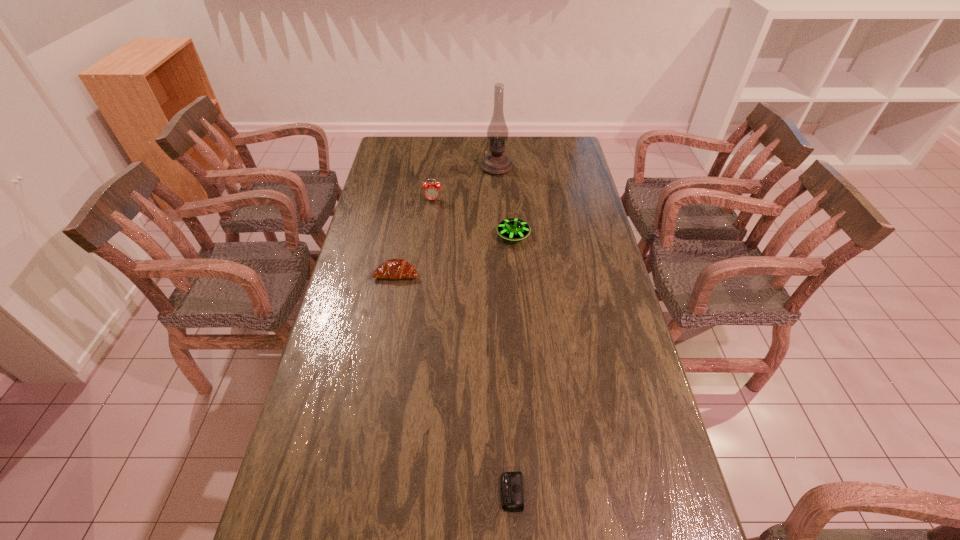
Where is `vacant point located between the second farthest object and the fourth farthest object`? The height and width of the screenshot is (540, 960). vacant point located between the second farthest object and the fourth farthest object is located at coordinates click(415, 237).

You are a GUI agent. You are given a task and a screenshot of the screen. Output one action in this format:
    pyautogui.click(x=<x>, y=<y>)
    Task: Click on the vacant area that lies between the fourth farthest object and the left alarm clock
    
    Given the screenshot: What is the action you would take?
    pyautogui.click(x=415, y=237)

Find the location of a particular element. This screenshot has height=540, width=960. free spot between the tallest object and the fourth farthest object is located at coordinates tap(446, 220).

Find the location of a particular element. free space between the second tallest object and the nearest object is located at coordinates 472,346.

Choose which object is the nearest neighbor to the third shortest object. Please provide its 2D coordinates. Your answer should be formatted as a tuple, i.e. [(x, y)], where the tuple contains the x and y coordinates of a point satisfying the conditions above.

[(432, 191)]

Identify which object is the second nearest to the shorter alarm clock. Please provide its 2D coordinates. Your answer should be formatted as a tuple, i.e. [(x, y)], where the tuple contains the x and y coordinates of a point satisfying the conditions above.

[(513, 229)]

Locate an element on the screen. This screenshot has width=960, height=540. vacant space that satisfies the following two spatial constraints: 1. on the back side of the second nearest object; 2. on the right side of the oil lamp is located at coordinates (417, 167).

Locate an element on the screen. The image size is (960, 540). vacant space that satisfies the following two spatial constraints: 1. on the face of the saucer; 2. on the right side of the taller alarm clock is located at coordinates (x=428, y=236).

Locate an element on the screen. Image resolution: width=960 pixels, height=540 pixels. vacant space that satisfies the following two spatial constraints: 1. on the face of the fourth shortest object; 2. on the right side of the third farthest object is located at coordinates (428, 236).